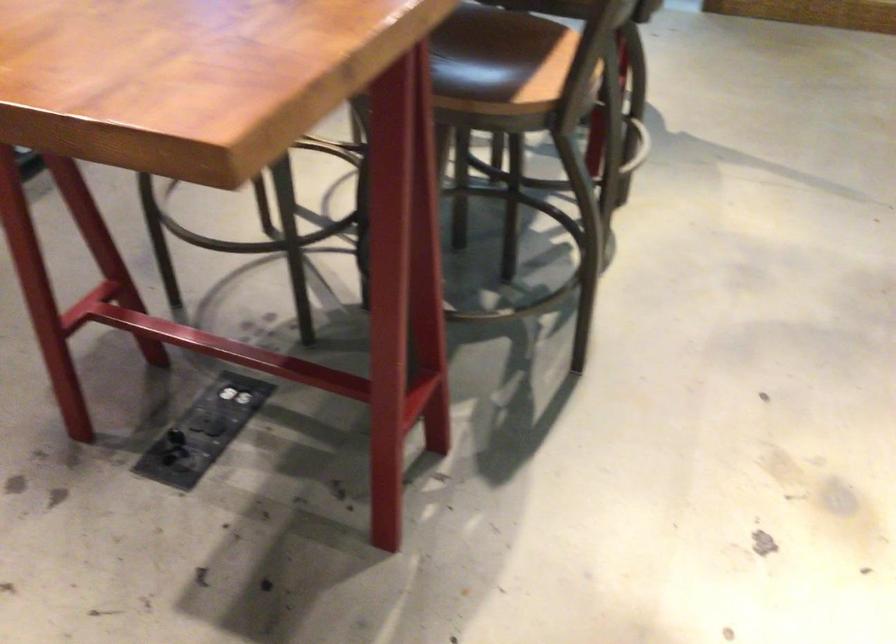
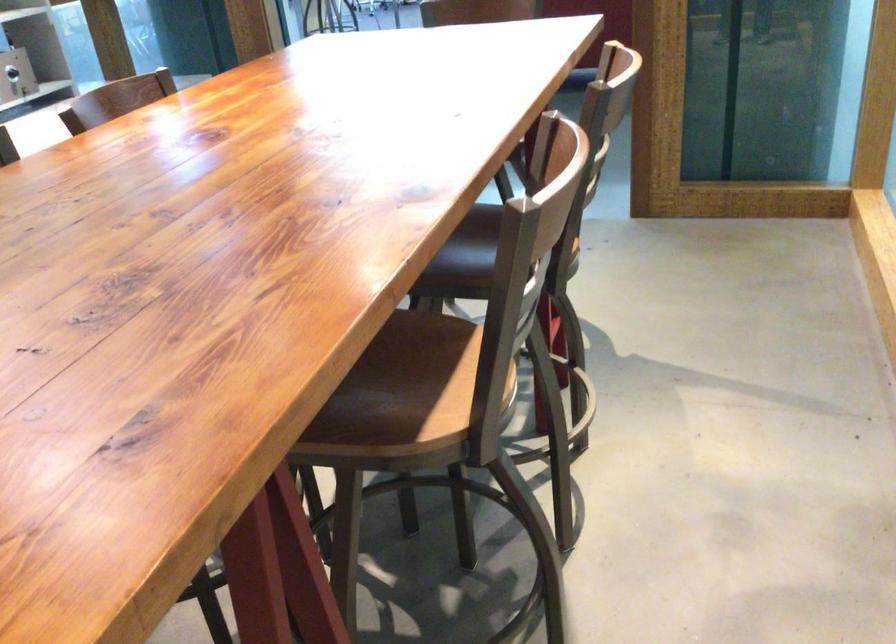
Which direction would the cameraman need to move to produce the second image?

The cameraman walked toward right, forward.